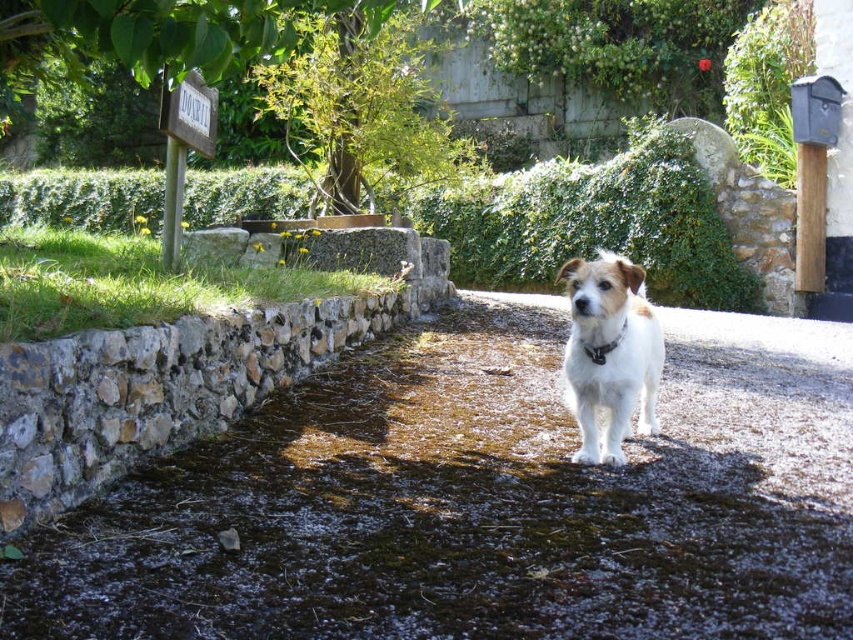
In the scene shown: Does white fur dog at center have a larger size compared to black leather neckband at center?

Indeed, white fur dog at center has a larger size compared to black leather neckband at center.

Measure the distance between white fur dog at center and camera.

6.95 feet

At what (x,y) coordinates should I click in order to perform the action: click on white fur dog at center. Please return your answer as a coordinate pair (x, y). The width and height of the screenshot is (853, 640). Looking at the image, I should click on (608, 353).

Is brown stone path at center thinner than white fur dog at center?

No.

Does brown stone path at center come in front of white fur dog at center?

Yes, brown stone path at center is in front of white fur dog at center.

This screenshot has height=640, width=853. What are the coordinates of `brown stone path at center` in the screenshot? It's located at (480, 500).

Which is above, brown stone path at center or black leather neckband at center?

black leather neckband at center is above.

Does brown stone path at center lie behind black leather neckband at center?

No, brown stone path at center is closer to the viewer.

I want to click on brown stone path at center, so click(480, 500).

At what (x,y) coordinates should I click in order to perform the action: click on brown stone path at center. Please return your answer as a coordinate pair (x, y). Image resolution: width=853 pixels, height=640 pixels. Looking at the image, I should click on (480, 500).